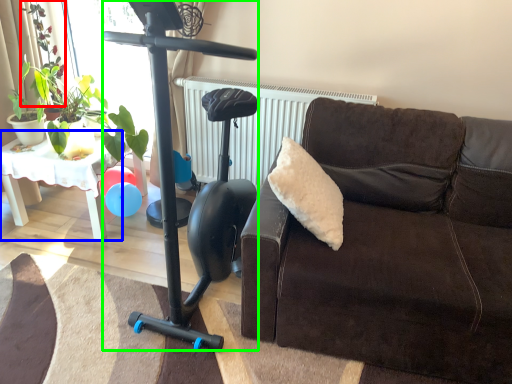
Question: Estimate the real-world distances between objects in this image. Which object is farther from plant (highlighted by a red box), table (highlighted by a blue box) or mobility scooter (highlighted by a green box)?

Choices:
 (A) table
 (B) mobility scooter

Answer: (B)